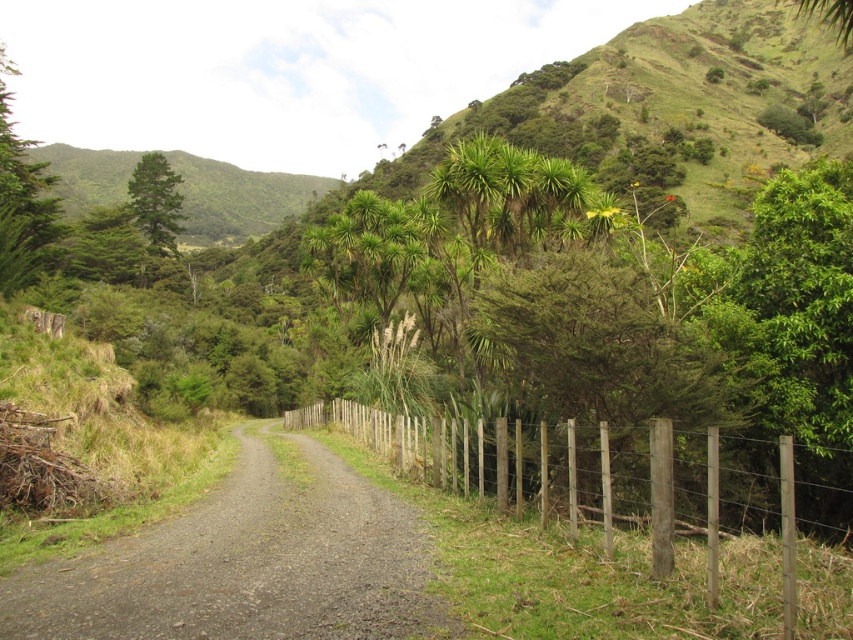
You are standing at the starting point of the dirt road in the rural landscape. You notice two points marked on the road ahead. The first point is at coordinates point (x=212, y=189) and the second is at point (x=140, y=218). If you walk forward along the road, which point will you encounter first?

You will encounter point (x=140, y=218) first because it is closer to your starting position compared to point (x=212, y=189), which is further ahead on the road.

You are a hiker trying to decide whether to walk on the gray gravel road at center or along the brown wooden fence at center. Considering their sizes, which path would allow you to walk further without needing to backtrack?

The brown wooden fence at center is larger in size than the gray gravel road at center, so walking along the brown wooden fence at center would allow you to walk further without needing to backtrack.

You are driving a car with a width of 1.8 meters. You come across the gray gravel road at center and the brown wooden fence at center. Can your car safely pass through the road without hitting the fence?

The gray gravel road at center is narrower than the brown wooden fence at center. Since the road is narrower, the car with a width of 1.8 meters may not have enough space to pass safely without risking collision with the fence.